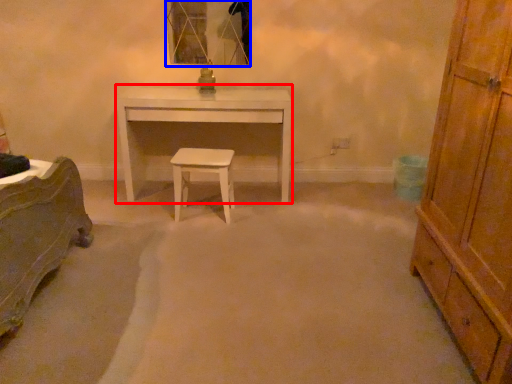
Question: Which object appears farthest to the camera in this image, desk (highlighted by a red box) or mirror (highlighted by a blue box)?

Choices:
 (A) desk
 (B) mirror

Answer: (B)